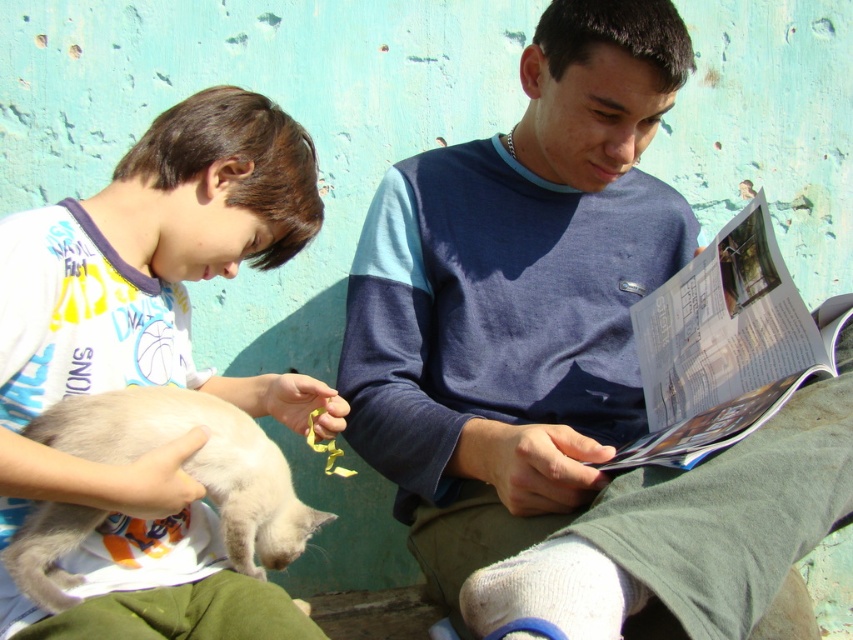
Question: Which object appears closest to the camera in this image?

Choices:
 (A) white fur cat at lower left
 (B) blue cotton shirt at center
 (C) silky white cat at lower left

Answer: (B)

Question: Can you confirm if white fur cat at lower left is bigger than silky white cat at lower left?

Choices:
 (A) no
 (B) yes

Answer: (B)

Question: Which object is closer to the camera taking this photo?

Choices:
 (A) silky white cat at lower left
 (B) blue cotton shirt at center

Answer: (B)

Question: Which point is farther from the camera taking this photo?

Choices:
 (A) (474, 324)
 (B) (6, 316)
 (C) (115, 394)

Answer: (A)

Question: Is white fur cat at lower left above silky white cat at lower left?

Choices:
 (A) no
 (B) yes

Answer: (B)

Question: Can you confirm if blue cotton shirt at center is thinner than silky white cat at lower left?

Choices:
 (A) yes
 (B) no

Answer: (B)